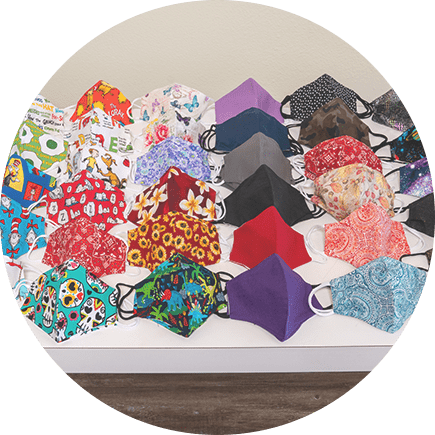
You are a GUI agent. You are given a task and a screenshot of the screen. Output one action in this format:
    pyautogui.click(x=<x>, y=<y>)
    Task: Click on the white table
    The image size is (435, 435).
    Given the screenshot: What is the action you would take?
    pyautogui.click(x=230, y=332)